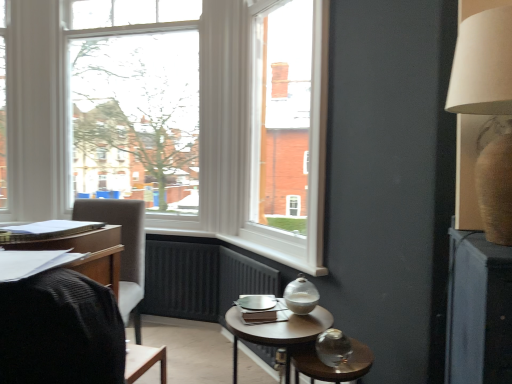
Question: Considering the positions of beige fabric lampshade at upper right and wooden round table at center in the image, is beige fabric lampshade at upper right wider or thinner than wooden round table at center?

Choices:
 (A) wide
 (B) thin

Answer: (B)

Question: Considering the positions of beige fabric lampshade at upper right and wooden round table at center in the image, is beige fabric lampshade at upper right bigger or smaller than wooden round table at center?

Choices:
 (A) big
 (B) small

Answer: (B)

Question: Estimate the real-world distances between objects in this image. Which object is farther from the wooden round table at center?

Choices:
 (A) knitted fabric chair at left
 (B) matte black desk at left
 (C) clear glass window at upper left
 (D) matte blue book at left
 (E) beige fabric lampshade at upper right

Answer: (C)

Question: Estimate the real-world distances between objects in this image. Which object is closer to the matte blue book at left?

Choices:
 (A) clear glass window at upper left
 (B) transparent glass table at lower right
 (C) matte black desk at left
 (D) knitted fabric chair at left
 (E) beige fabric lampshade at upper right

Answer: (C)